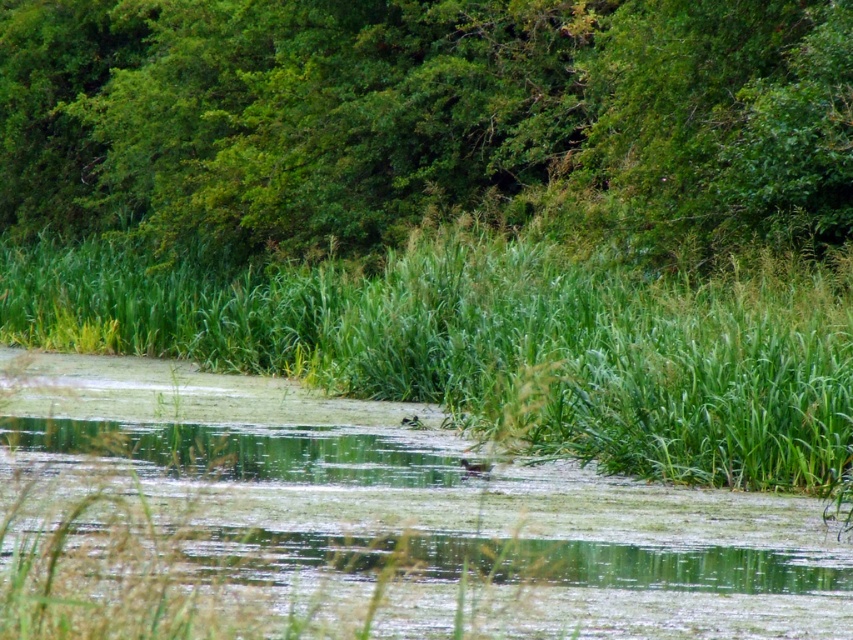
You are standing in the middle of the scene and want to take a photo of both the green leafy trees at upper center and the green grass at center. Which object will appear bigger in your photo?

The green leafy trees at upper center will appear bigger in the photo because they have a larger size compared to the green grass at center.

You are a bird flying over the green leafy trees at upper center and the green grass at center. Which object is higher in the scene?

The green leafy trees at upper center are higher than the green grass at center.

You are standing at the point with coordinates point (805, 284) and want to reach the point with coordinates point (53, 106). Based on the scene description, which direction should you move to get there?

Since point (53, 106) is behind point (805, 284), you should move in the direction away from the current position towards the point (53, 106).